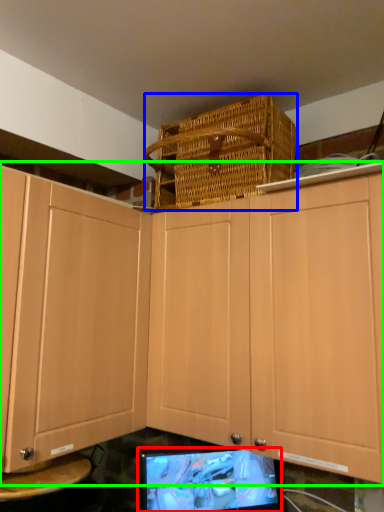
Question: Considering the real-world distances, which object is farthest from computer monitor (highlighted by a red box)? basket (highlighted by a blue box) or cabinetry (highlighted by a green box)?

Choices:
 (A) basket
 (B) cabinetry

Answer: (A)